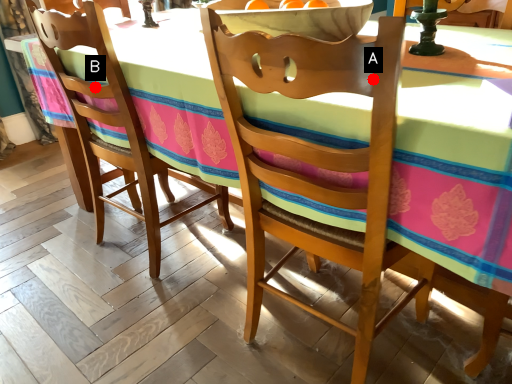
Question: Two points are circled on the image, labeled by A and B beside each circle. Which point appears closest to the camera in this image?

Choices:
 (A) A is closer
 (B) B is closer

Answer: (A)